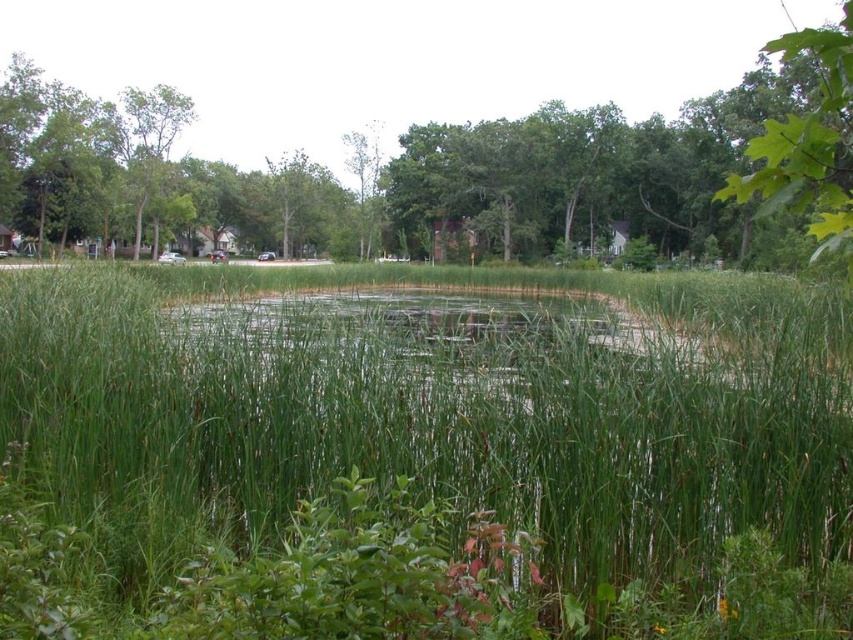
Question: Which point is farther from the camera taking this photo?

Choices:
 (A) [657, 410]
 (B) [277, 202]
 (C) [817, 113]

Answer: (B)

Question: Is green grass at center below green leafy tree at upper right?

Choices:
 (A) yes
 (B) no

Answer: (A)

Question: Which object is the farthest from the green leafy tree at upper right?

Choices:
 (A) green grass at center
 (B) green leafy tree at center

Answer: (B)

Question: Which point appears farthest from the camera in this image?

Choices:
 (A) (825, 122)
 (B) (608, 204)

Answer: (B)

Question: In this image, where is green grass at center located relative to green leafy tree at upper right?

Choices:
 (A) above
 (B) below

Answer: (B)

Question: Does green grass at center appear over green leafy tree at center?

Choices:
 (A) yes
 (B) no

Answer: (B)